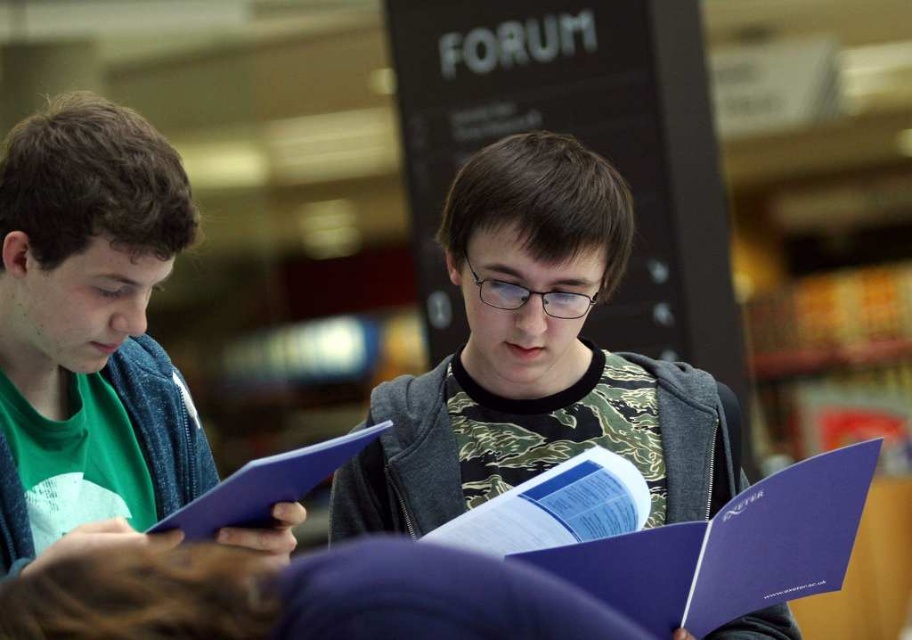
Question: Is matte blue folder at left closer to camera compared to purple paper folder at center?

Choices:
 (A) yes
 (B) no

Answer: (A)

Question: Which point is closer to the camera taking this photo?

Choices:
 (A) (760, 637)
 (B) (242, 493)

Answer: (B)

Question: Does matte blue folder at left have a greater width compared to purple paper folder at center?

Choices:
 (A) yes
 (B) no

Answer: (B)

Question: Where is purple paper folder at center located in relation to matte blue folder at center in the image?

Choices:
 (A) right
 (B) left

Answer: (A)

Question: Based on their relative distances, which object is nearer to the matte blue folder at center?

Choices:
 (A) matte blue folder at left
 (B) camouflage-patterned shirt at center

Answer: (A)

Question: Which is nearer to the matte blue folder at left?

Choices:
 (A) camouflage-patterned shirt at center
 (B) matte blue folder at center
 (C) purple paper folder at center

Answer: (B)